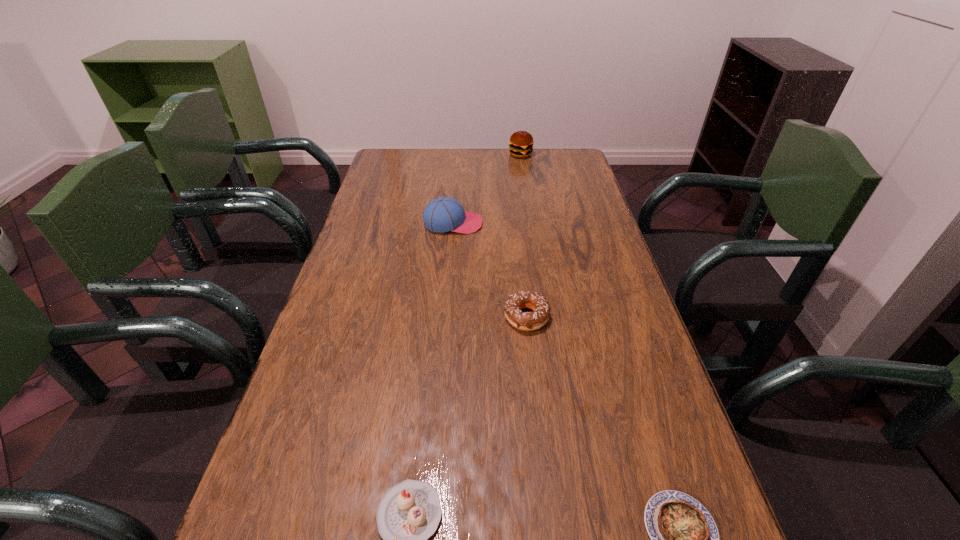
Where is `vacant space at the far right corner of the desktop`? vacant space at the far right corner of the desktop is located at coordinates (567, 161).

Locate an element on the screen. The height and width of the screenshot is (540, 960). free space between the fourth nearest object and the farthest object is located at coordinates (487, 189).

The height and width of the screenshot is (540, 960). What are the coordinates of `object that is the third nearest to the doughnut` in the screenshot? It's located at (684, 537).

The width and height of the screenshot is (960, 540). I want to click on object that is the second closest to the shortest object, so click(527, 321).

You are a GUI agent. You are given a task and a screenshot of the screen. Output one action in this format:
    pyautogui.click(x=<x>, y=<y>)
    Task: Click on the free space that satisfies the following two spatial constraints: 1. on the front side of the hamburger; 2. on the front-facing side of the second farthest object
    Image resolution: width=960 pixels, height=540 pixels.
    Given the screenshot: What is the action you would take?
    pyautogui.click(x=531, y=223)

Locate an element on the screen. vacant region that satisfies the following two spatial constraints: 1. on the front-facing side of the fourth nearest object; 2. on the right side of the doughnut is located at coordinates (445, 317).

Where is `free point that satisfies the following two spatial constraints: 1. on the front-facing side of the fourth nearest object; 2. on the back side of the doughnut`? free point that satisfies the following two spatial constraints: 1. on the front-facing side of the fourth nearest object; 2. on the back side of the doughnut is located at coordinates (445, 317).

Where is `free location that satisfies the following two spatial constraints: 1. on the front side of the hamburger; 2. on the front-facing side of the baseball cap`? The image size is (960, 540). free location that satisfies the following two spatial constraints: 1. on the front side of the hamburger; 2. on the front-facing side of the baseball cap is located at coordinates (531, 223).